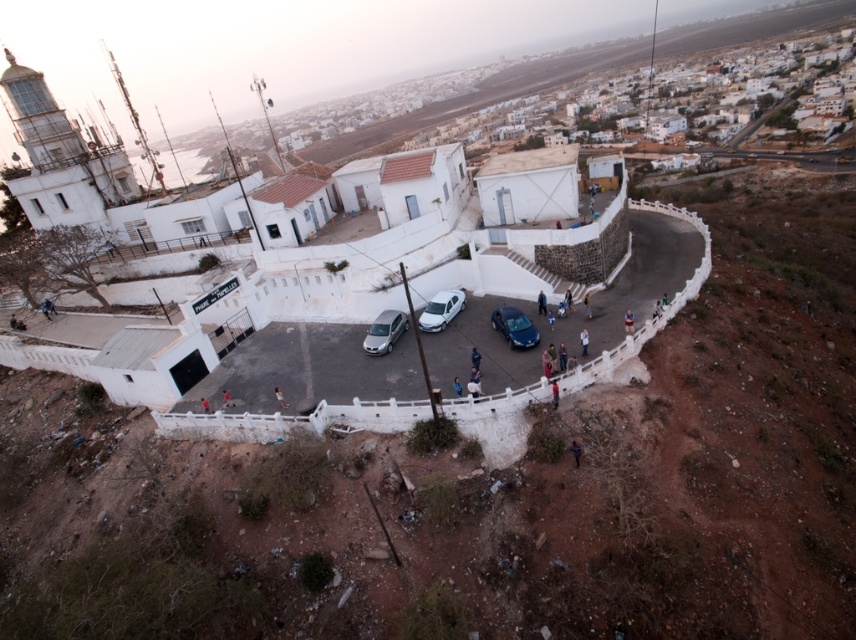
You are a tour guide leading a group to the lighthouse. You notice a shiny dark blue sedan at center and dark blue jeans at center in the parking area. Can you tell the group how far apart these two items are?

The shiny dark blue sedan at center and dark blue jeans at center are 5.23 meters apart from each other.

You are a tour guide explaining the parking area to visitors. You point out the shiny dark blue sedan at center and the orange fabric person at center. Which one is taller?

The shiny dark blue sedan at center is much taller than the orange fabric person at center.

You are a tour guide leading a group to the lighthouse. You notice the satin silver van at center and the dark blue jeans at center in the parking area. Which vehicle is taller?

The satin silver van at center is much taller than the dark blue jeans at center.